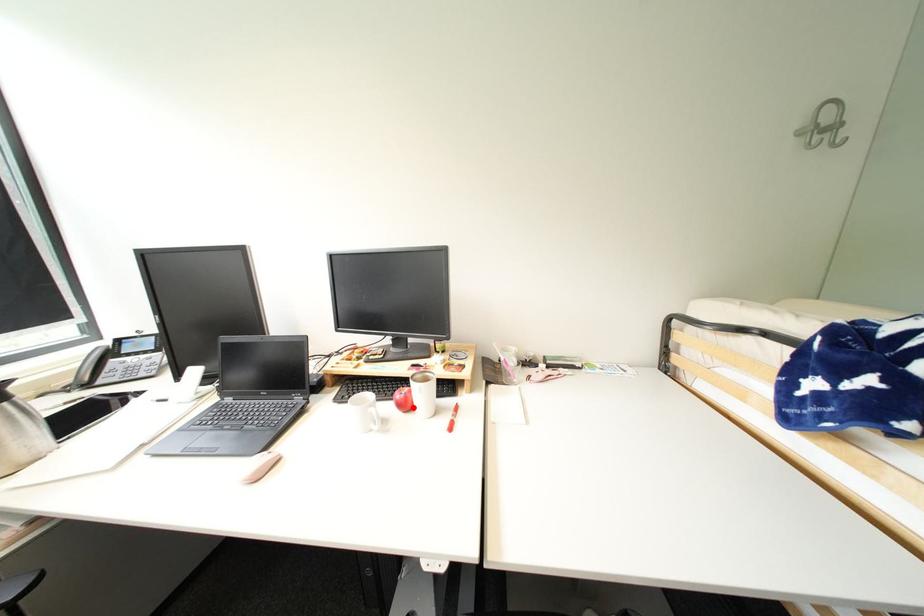
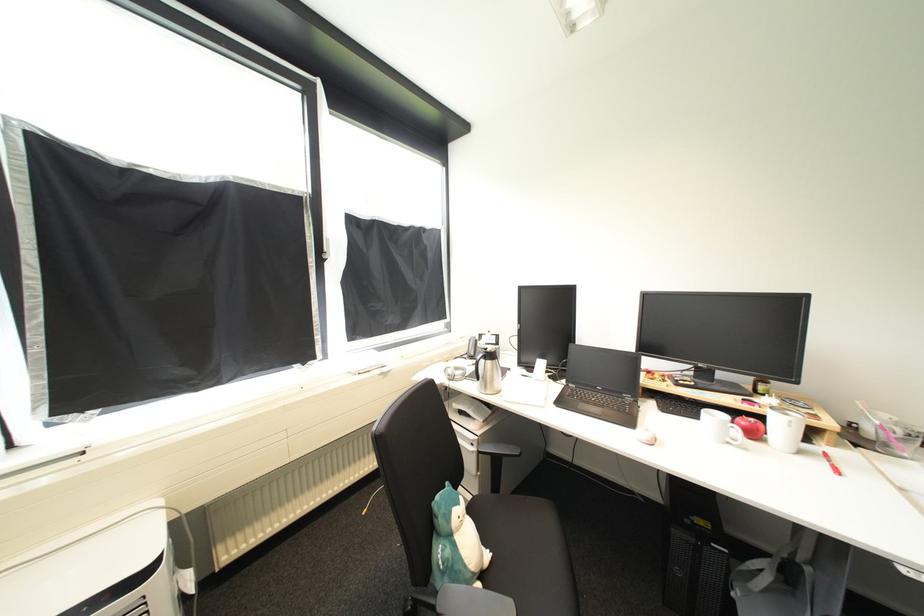
Question: I am providing you with two images of the same scene from different viewpoints. In image1, a red point is highlighted. Considering the same 3D point in image2, which of the following is correct?

Choices:
 (A) It is closer
 (B) It is farther

Answer: (A)